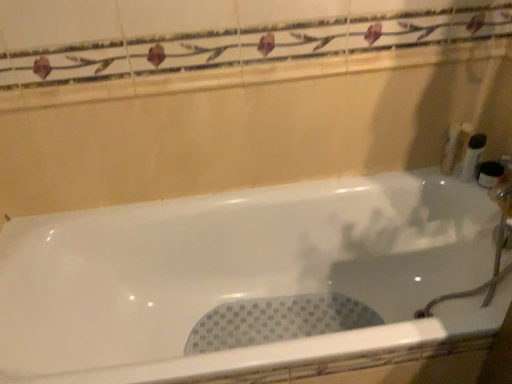
Question: Is white plastic bottle at right, which is the second toiletry in right-to-left order, wider than white glossy bathtub at center?

Choices:
 (A) yes
 (B) no

Answer: (B)

Question: Are white plastic bottle at right, arranged as the 3th toiletry when viewed from the left, and white glossy bathtub at center making contact?

Choices:
 (A) no
 (B) yes

Answer: (A)

Question: From the image's perspective, is white plastic bottle at right, which is the second toiletry in right-to-left order, under white glossy bathtub at center?

Choices:
 (A) yes
 (B) no

Answer: (B)

Question: Is white plastic bottle at right, which is the second toiletry in right-to-left order, at the left side of white glossy bathtub at center?

Choices:
 (A) yes
 (B) no

Answer: (B)

Question: Considering the relative positions of white plastic bottle at right, arranged as the 3th toiletry when viewed from the left, and white glossy bathtub at center in the image provided, is white plastic bottle at right, arranged as the 3th toiletry when viewed from the left, to the right of white glossy bathtub at center from the viewer's perspective?

Choices:
 (A) yes
 (B) no

Answer: (A)

Question: From a real-world perspective, is white plastic bottle at right, arranged as the 3th toiletry when viewed from the left, located beneath white glossy bathtub at center?

Choices:
 (A) yes
 (B) no

Answer: (B)

Question: Does white plastic bottle at right, placed as the 1th toiletry when sorted from left to right, contain white plastic bottle at right, the 1th toiletry from the right?

Choices:
 (A) yes
 (B) no

Answer: (B)

Question: Is white plastic bottle at right, placed as the 1th toiletry when sorted from left to right, to the right of white plastic bottle at right, the 1th toiletry from the right, from the viewer's perspective?

Choices:
 (A) yes
 (B) no

Answer: (B)

Question: Considering the relative sizes of white plastic bottle at right, placed as the 1th toiletry when sorted from left to right, and white plastic bottle at right, which is the fourth toiletry from left to right, in the image provided, is white plastic bottle at right, placed as the 1th toiletry when sorted from left to right, taller than white plastic bottle at right, which is the fourth toiletry from left to right,?

Choices:
 (A) yes
 (B) no

Answer: (A)

Question: Is white plastic bottle at right, placed as the 1th toiletry when sorted from left to right, with white plastic bottle at right, the 1th toiletry from the right?

Choices:
 (A) no
 (B) yes

Answer: (A)

Question: From the image's perspective, would you say white plastic bottle at right, the fourth toiletry from the right, is shown under white plastic bottle at right, which is the fourth toiletry from left to right?

Choices:
 (A) no
 (B) yes

Answer: (A)

Question: From a real-world perspective, is white plastic bottle at right, placed as the 1th toiletry when sorted from left to right, positioned under white plastic bottle at right, which is the fourth toiletry from left to right, based on gravity?

Choices:
 (A) yes
 (B) no

Answer: (B)

Question: Is white plastic bottle at right, which is the second toiletry in right-to-left order, at the back of white plastic container at right, the 2th toiletry in the left-to-right sequence?

Choices:
 (A) yes
 (B) no

Answer: (B)